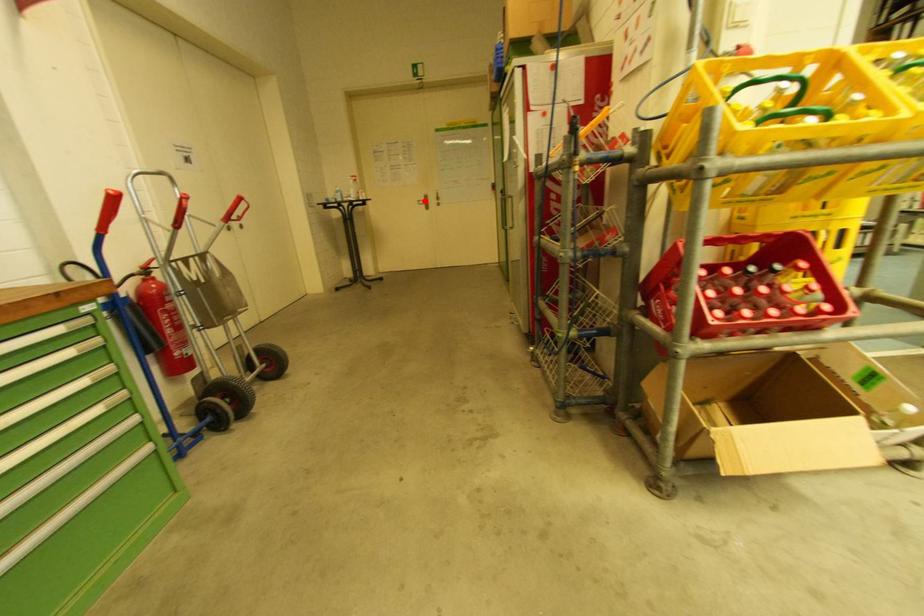
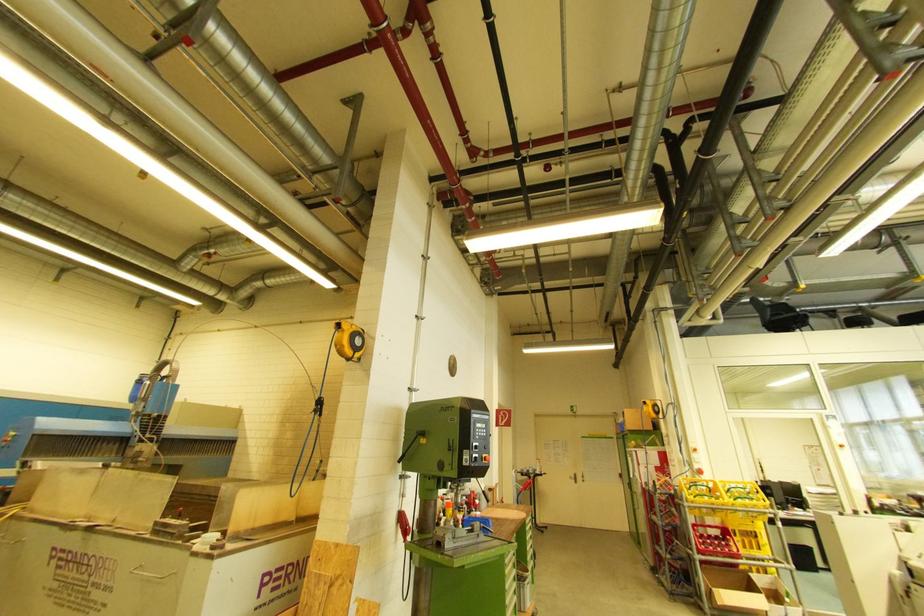
Question: I am providing you with two images of the same scene from different viewpoints. Image1 has a red point marked. In image2, the corresponding 3D location appears at what relative position? Reply with the corresponding letter.

Choices:
 (A) Closer
 (B) Farther

Answer: (B)